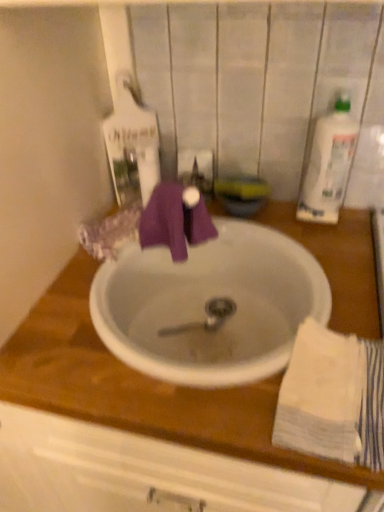
Identify the location of free space to the left of white cotton towel at lower right. The height and width of the screenshot is (512, 384). (227, 400).